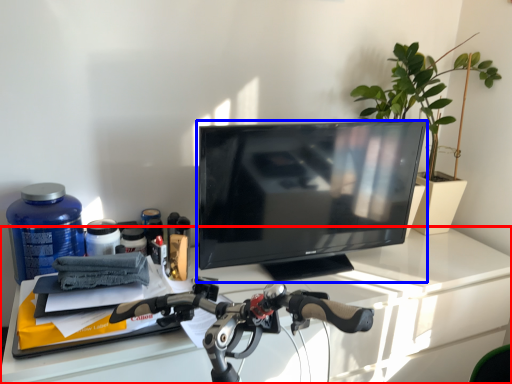
Question: Which object is further to the camera taking this photo, desk (highlighted by a red box) or television (highlighted by a blue box)?

Choices:
 (A) desk
 (B) television

Answer: (B)